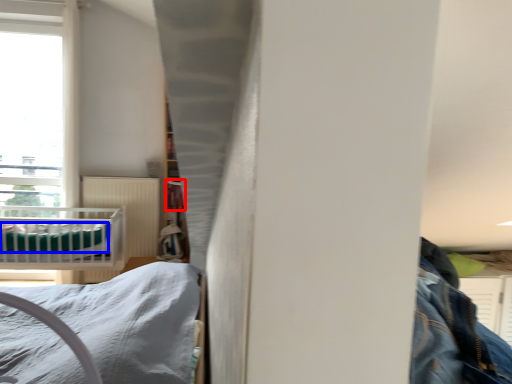
Question: Which object appears farthest to the camera in this image, shelf (highlighted by a red box) or sheet (highlighted by a blue box)?

Choices:
 (A) shelf
 (B) sheet

Answer: (A)